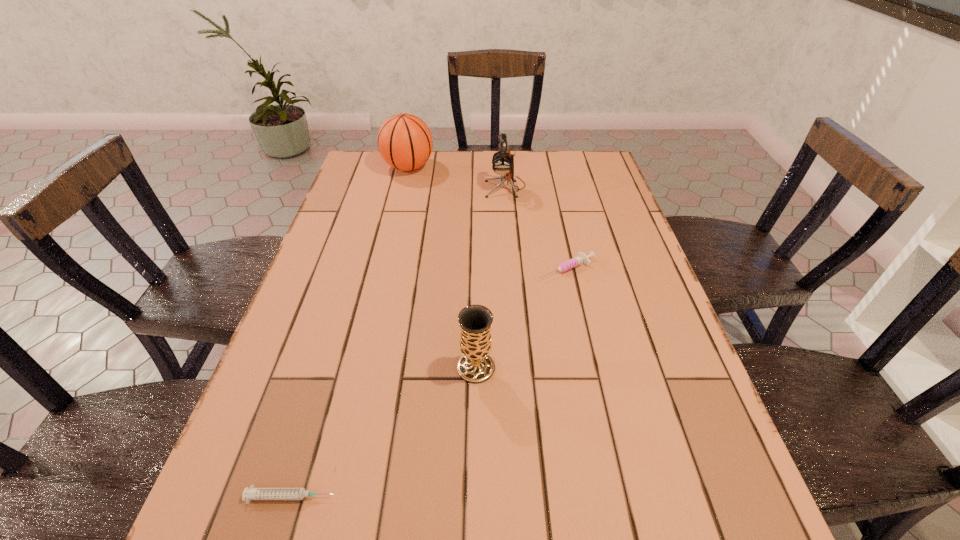
In the image, there is a desktop. At what (x,y) coordinates should I click in order to perform the action: click on free region at the left edge. Please return your answer as a coordinate pair (x, y). Looking at the image, I should click on (370, 269).

The height and width of the screenshot is (540, 960). Find the location of `vacant space at the right edge`. vacant space at the right edge is located at coordinates (674, 382).

The width and height of the screenshot is (960, 540). In the image, there is a desktop. What are the coordinates of `vacant space at the far left corner` in the screenshot? It's located at (363, 159).

Locate an element on the screen. This screenshot has height=540, width=960. free spot between the left syringe and the earphone is located at coordinates (398, 342).

The width and height of the screenshot is (960, 540). I want to click on vacant area that lies between the basketball and the earphone, so click(x=457, y=177).

Where is `free space between the left syringe and the fourth farthest object`? free space between the left syringe and the fourth farthest object is located at coordinates (384, 432).

Where is `free space between the nearer syringe and the basketball`? The image size is (960, 540). free space between the nearer syringe and the basketball is located at coordinates (349, 332).

Where is `free spot between the chalice and the earphone`? free spot between the chalice and the earphone is located at coordinates (491, 277).

You are a GUI agent. You are given a task and a screenshot of the screen. Output one action in this format:
    pyautogui.click(x=<x>, y=<y>)
    Task: Click on the vacant space in between the basketball and the third tallest object
    
    Given the screenshot: What is the action you would take?
    pyautogui.click(x=443, y=267)

Where is `free space between the left syringe and the farther syringe`? The image size is (960, 540). free space between the left syringe and the farther syringe is located at coordinates (429, 383).